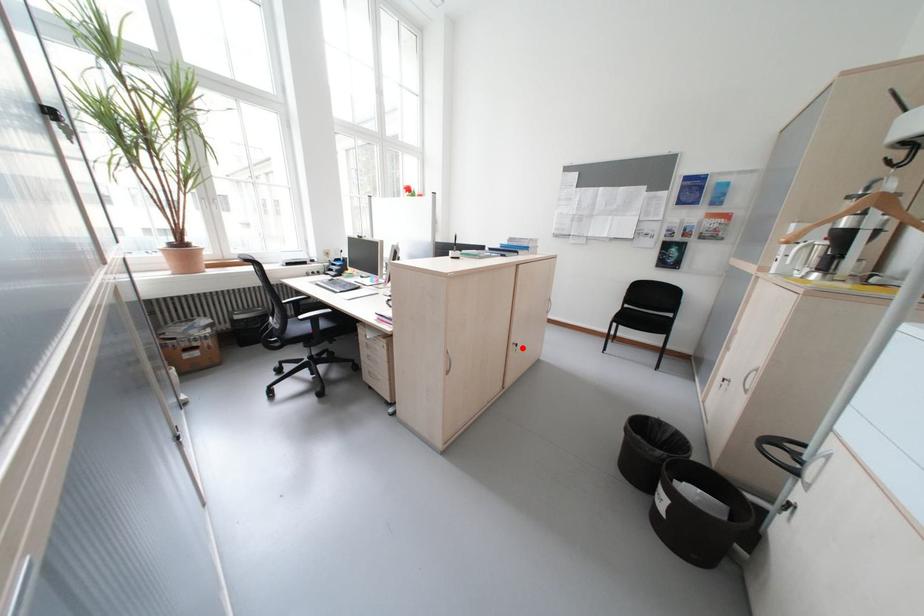
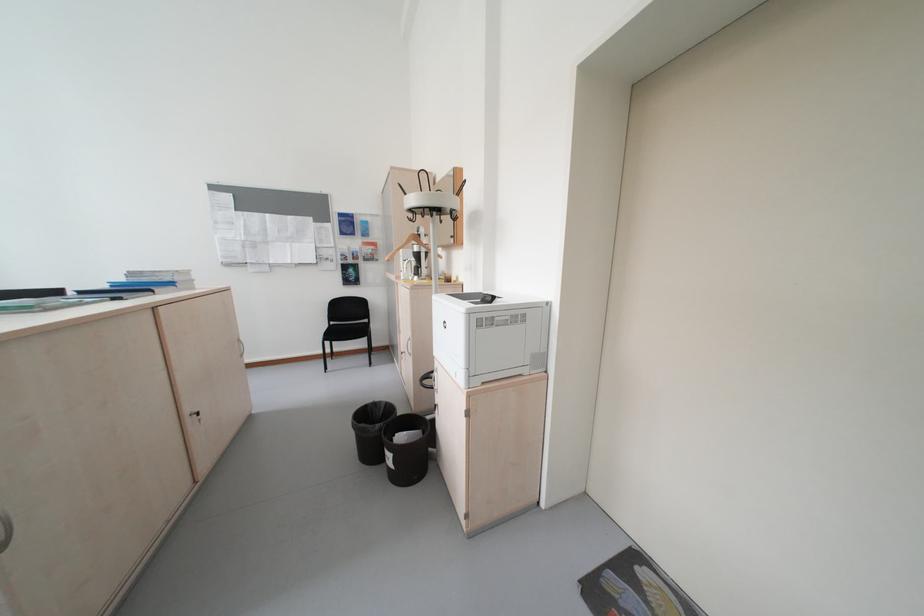
Where in the second image is the point corresponding to the highlighted location from the first image?

(200, 421)